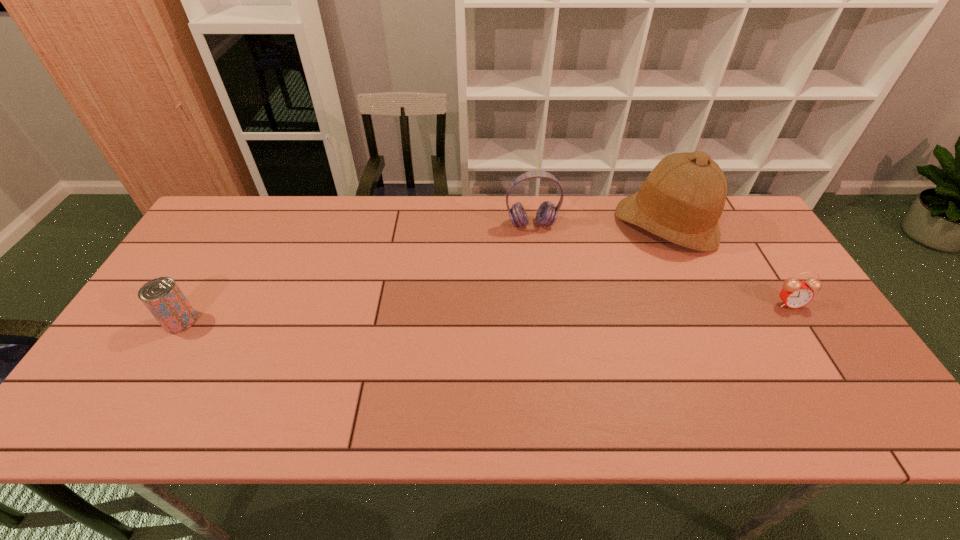
You are a GUI agent. You are given a task and a screenshot of the screen. Output one action in this format:
    pyautogui.click(x=<x>, y=<y>)
    Task: Click on the blank space that satisfies the following two spatial constraints: 1. on the back side of the headset; 2. on the right side of the beer can
    This screenshot has width=960, height=540.
    Given the screenshot: What is the action you would take?
    pyautogui.click(x=239, y=224)